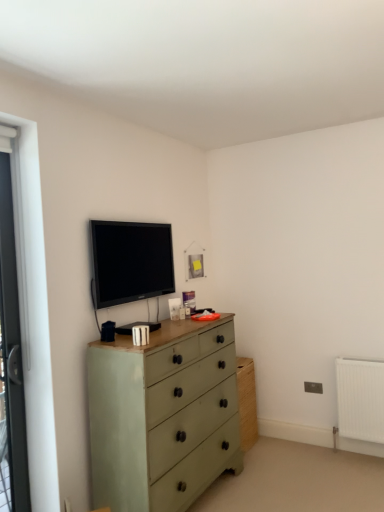
Question: Is white plastic screen door at left at the back of matte green chest of drawers at center?

Choices:
 (A) yes
 (B) no

Answer: (B)

Question: Is white plastic screen door at left completely or partially inside matte green chest of drawers at center?

Choices:
 (A) no
 (B) yes

Answer: (A)

Question: Is matte green chest of drawers at center to the right of white plastic screen door at left from the viewer's perspective?

Choices:
 (A) yes
 (B) no

Answer: (A)

Question: Is matte green chest of drawers at center thinner than white plastic screen door at left?

Choices:
 (A) yes
 (B) no

Answer: (B)

Question: Considering the relative sizes of matte green chest of drawers at center and white plastic screen door at left in the image provided, is matte green chest of drawers at center wider than white plastic screen door at left?

Choices:
 (A) no
 (B) yes

Answer: (B)

Question: Considering their positions, is white plastic screen door at left located in front of or behind matte green chest of drawers at center?

Choices:
 (A) behind
 (B) front

Answer: (A)

Question: From the image's perspective, is white plastic screen door at left positioned above or below matte green chest of drawers at center?

Choices:
 (A) above
 (B) below

Answer: (A)

Question: Do you think white plastic screen door at left is within matte green chest of drawers at center, or outside of it?

Choices:
 (A) inside
 (B) outside

Answer: (B)

Question: Considering the relative positions of white plastic screen door at left and matte green chest of drawers at center in the image provided, is white plastic screen door at left to the left or to the right of matte green chest of drawers at center?

Choices:
 (A) right
 (B) left

Answer: (B)

Question: Considering the relative positions of matte green chest of drawers at center and matte black tv at upper center in the image provided, is matte green chest of drawers at center to the left or to the right of matte black tv at upper center?

Choices:
 (A) left
 (B) right

Answer: (B)

Question: Is matte green chest of drawers at center wider or thinner than matte black tv at upper center?

Choices:
 (A) thin
 (B) wide

Answer: (B)

Question: Is point (168, 337) positioned closer to the camera than point (120, 231)?

Choices:
 (A) closer
 (B) farther

Answer: (A)

Question: From a real-world perspective, is matte green chest of drawers at center physically located above or below matte black tv at upper center?

Choices:
 (A) below
 (B) above

Answer: (A)

Question: From a real-world perspective, is white plastic screen door at left physically located above or below matte black tv at upper center?

Choices:
 (A) above
 (B) below

Answer: (B)

Question: Considering their positions, is white plastic screen door at left located in front of or behind matte black tv at upper center?

Choices:
 (A) behind
 (B) front

Answer: (B)